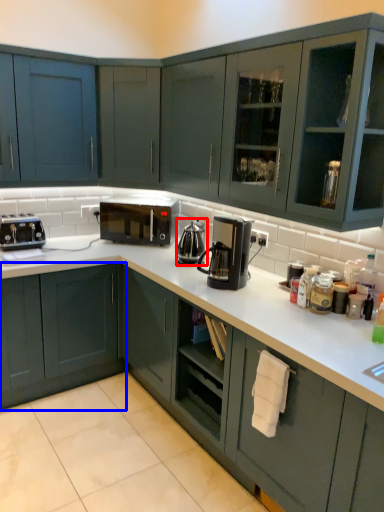
Question: Which of the following is the farthest to the observer, coffeepot (highlighted by a red box) or cabinetry (highlighted by a blue box)?

Choices:
 (A) coffeepot
 (B) cabinetry

Answer: (A)